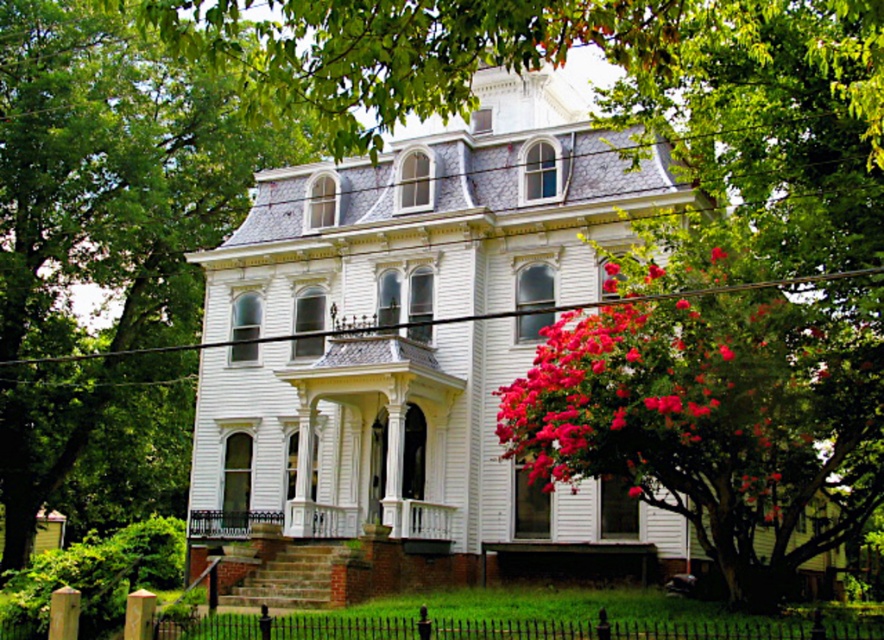
Question: Which object is farther from the camera taking this photo?

Choices:
 (A) green leafy tree at upper left
 (B) white painted wood porch at center
 (C) vivid pink petals at right

Answer: (B)

Question: Which of these objects is positioned closest to the green leafy tree at upper left?

Choices:
 (A) vivid pink petals at right
 (B) white painted wood porch at center

Answer: (A)

Question: Does vivid pink petals at right have a smaller size compared to white painted wood porch at center?

Choices:
 (A) no
 (B) yes

Answer: (A)

Question: Which object is the closest to the white painted wood porch at center?

Choices:
 (A) green leafy tree at upper left
 (B) vivid pink petals at right

Answer: (B)

Question: Can you confirm if green leafy tree at upper left is positioned below white painted wood porch at center?

Choices:
 (A) yes
 (B) no

Answer: (B)

Question: Does green leafy tree at upper left have a lesser width compared to vivid pink petals at right?

Choices:
 (A) yes
 (B) no

Answer: (B)